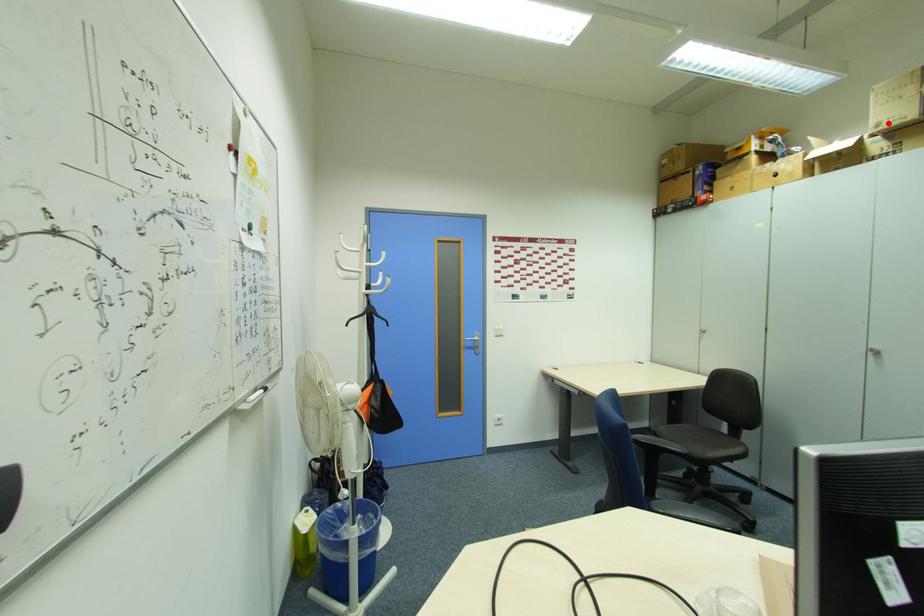
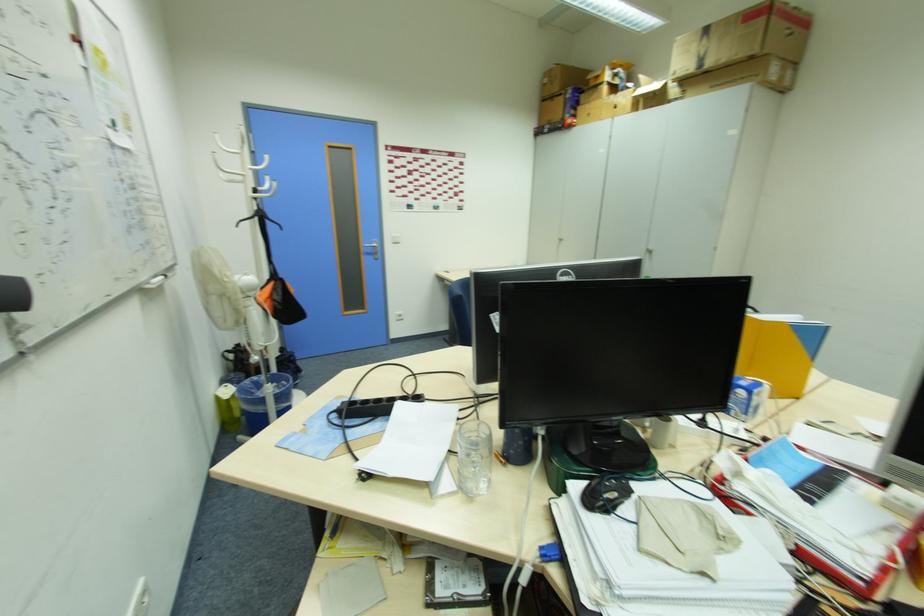
Find the pixel in the second image that matches the highlighted location in the first image.

(685, 71)